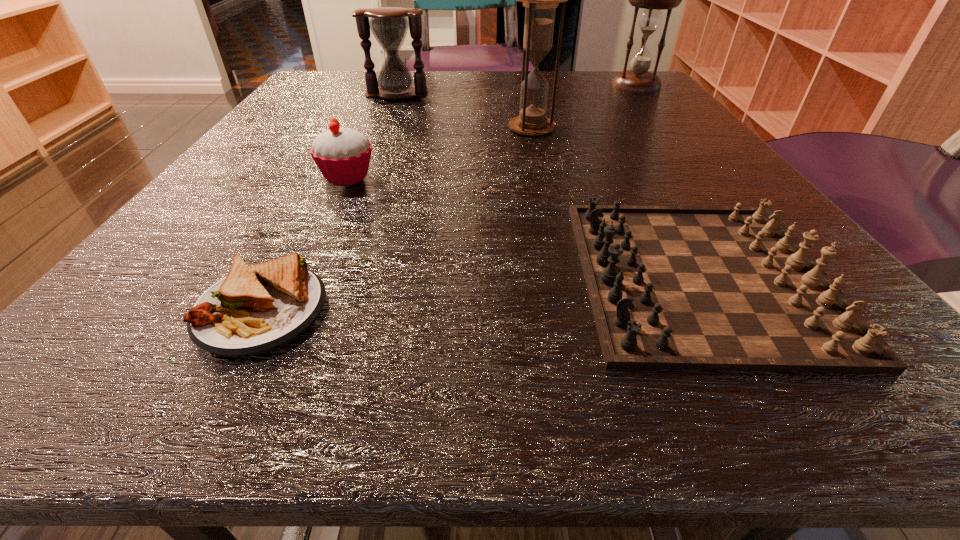
Where is `vacant space at the far right corner of the desktop`? The height and width of the screenshot is (540, 960). vacant space at the far right corner of the desktop is located at coordinates (628, 105).

Where is `empty location between the shortest object and the fourth farthest object`? This screenshot has width=960, height=540. empty location between the shortest object and the fourth farthest object is located at coordinates (304, 244).

Identify the location of vacant area that lies between the sandwich and the fourth tallest object. (304, 244).

Find the location of a particular element. This screenshot has height=540, width=960. unoccupied position between the rightmost hourglass and the leftmost hourglass is located at coordinates (516, 91).

Identify the location of vacant space in between the leftmost hourglass and the chessboard. This screenshot has height=540, width=960. (549, 186).

Identify the location of unoccupied area between the leftmost hourglass and the tallest hourglass. The height and width of the screenshot is (540, 960). (465, 112).

Identify the location of free area in between the rightmost hourglass and the leftmost hourglass. (516, 91).

This screenshot has width=960, height=540. In order to click on unoccupied area between the sandwich and the chessboard in this screenshot , I will do `click(481, 293)`.

The width and height of the screenshot is (960, 540). In order to click on free spot between the chessboard and the leftmost hourglass in this screenshot , I will do 549,186.

Locate an element on the screen. The height and width of the screenshot is (540, 960). free space between the sandwich and the third farthest object is located at coordinates (396, 219).